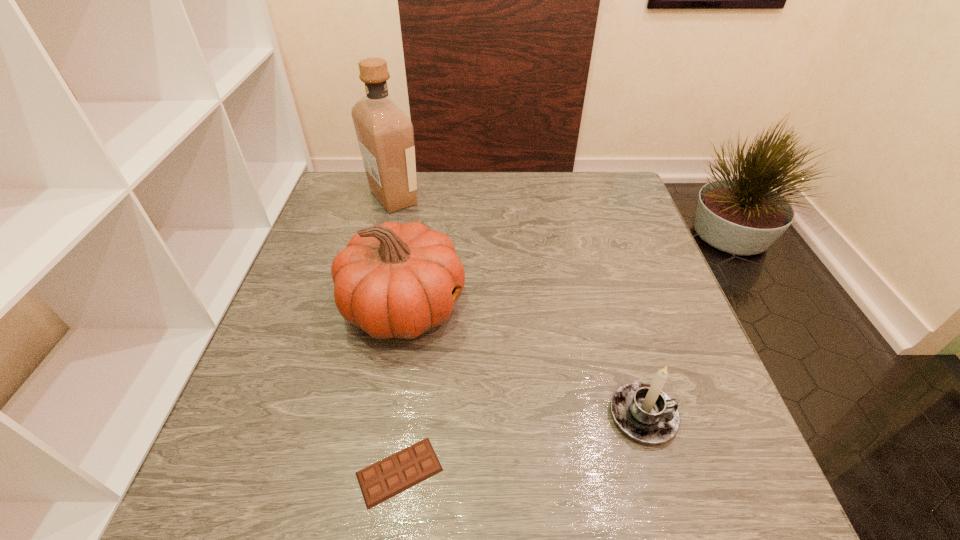
The height and width of the screenshot is (540, 960). Find the location of `free space at the right edge of the desktop`. free space at the right edge of the desktop is located at coordinates (715, 417).

Where is `vacant region at the near left corner`? The width and height of the screenshot is (960, 540). vacant region at the near left corner is located at coordinates (198, 508).

Where is `empty space between the candle holder and the chocolate bar`? empty space between the candle holder and the chocolate bar is located at coordinates (521, 443).

Locate an element on the screen. The width and height of the screenshot is (960, 540). free space between the candle holder and the shortest object is located at coordinates (521, 443).

The image size is (960, 540). I want to click on free space that is in between the third tallest object and the third nearest object, so [x=523, y=361].

This screenshot has height=540, width=960. Find the location of `free space between the third tallest object and the chocolate bar`. free space between the third tallest object and the chocolate bar is located at coordinates (521, 443).

Where is `object that is the second closest one to the second tallest object`? This screenshot has width=960, height=540. object that is the second closest one to the second tallest object is located at coordinates (385, 134).

Image resolution: width=960 pixels, height=540 pixels. I want to click on object that can be found as the third closest to the shortest object, so click(x=385, y=134).

The height and width of the screenshot is (540, 960). What are the coordinates of `vacant space that satisfies the following two spatial constraints: 1. on the front-facing side of the farthest object; 2. on the right side of the chocolate bar` in the screenshot? It's located at point(325,471).

This screenshot has height=540, width=960. I want to click on vacant space that satisfies the following two spatial constraints: 1. on the front-facing side of the liquor; 2. on the back side of the chocolate bar, so click(325, 471).